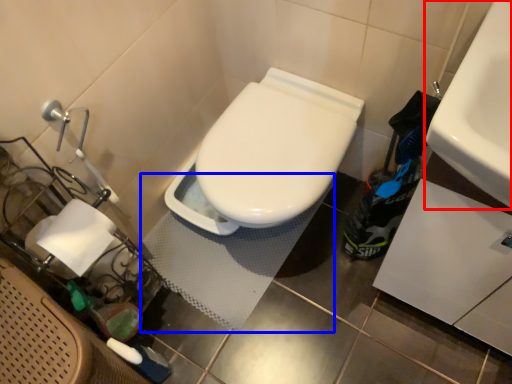
Question: Among these objects, which one is nearest to the camera, sink (highlighted by a red box) or bath mat (highlighted by a blue box)?

Choices:
 (A) sink
 (B) bath mat

Answer: (A)